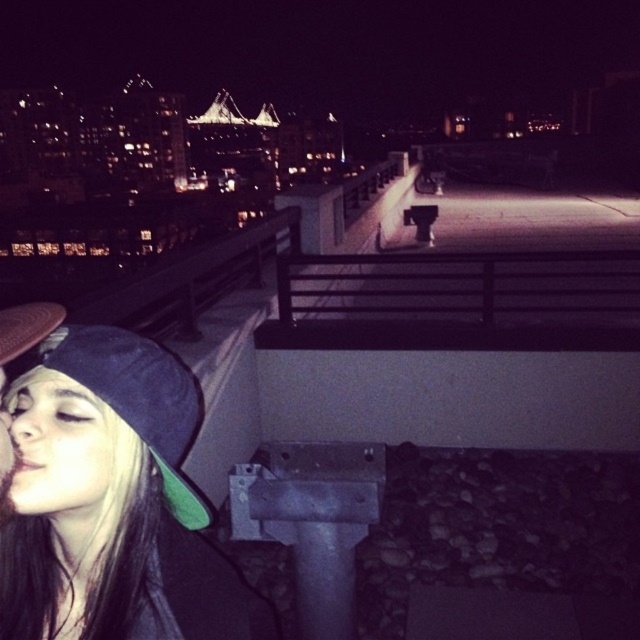
Consider the image. You are a photographer trying to capture the city lights in the background. There is a black matte cap at lower left in the frame. To ensure it doesn not obstruct the view, where should you position your camera relative to the cap?

Since the black matte cap at lower left is located at point (115, 502) in the frame, you should position your camera to the right and above the cap to avoid obstruction and capture the city lights in the background.

You are standing on the rooftop and want to move from the point at coordinates point (35, 493) to point (3, 451). Which direction should you move to reach your destination?

To move from point (35, 493) to point (3, 451), you should move towards the lower left direction since point (3, 451) is located to the lower left of point (35, 493) based on their coordinates.